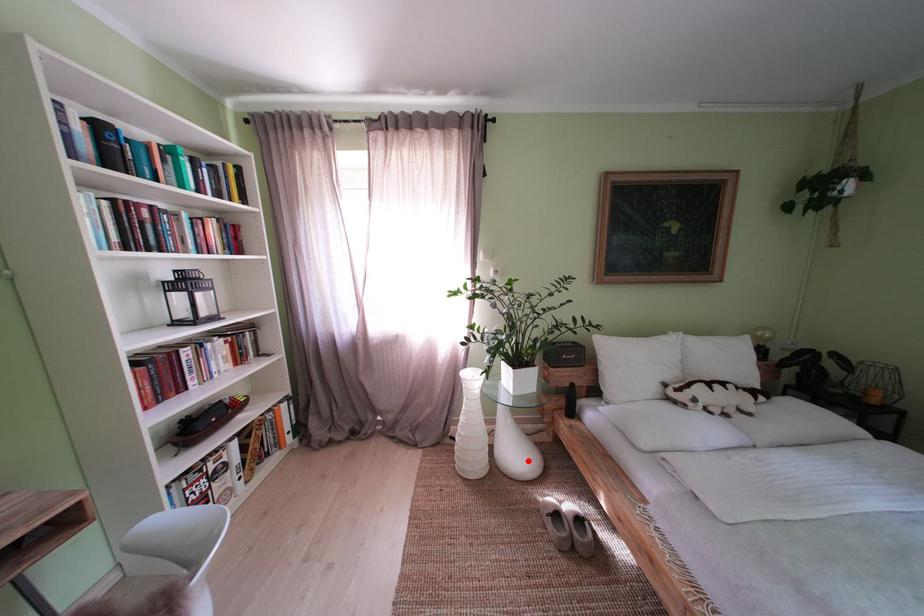
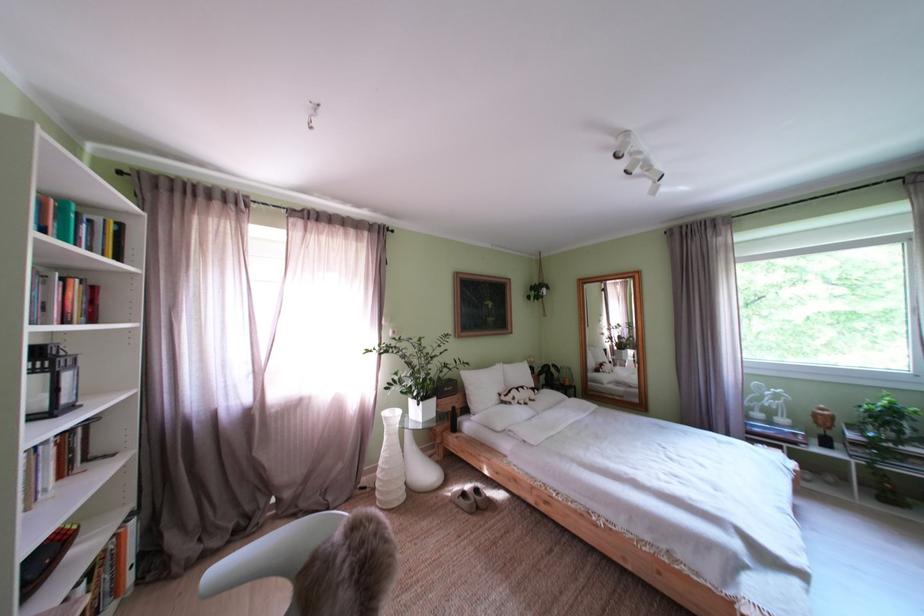
In the second image, find the point that corresponds to the highlighted location in the first image.

(438, 479)